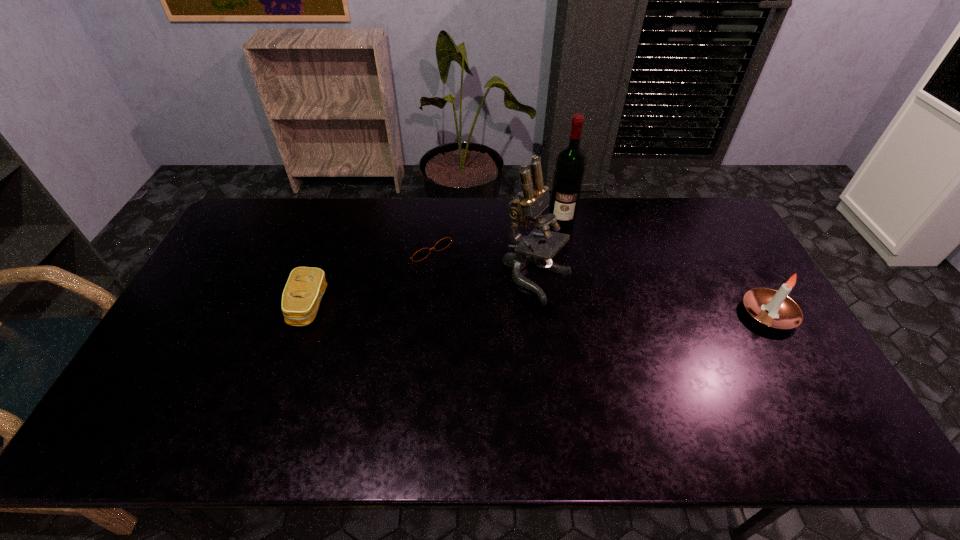
Locate an element on the screen. The height and width of the screenshot is (540, 960). free spot between the rightmost object and the microscope is located at coordinates (653, 296).

Identify the location of vacant region between the rightmost object and the farthest object. The height and width of the screenshot is (540, 960). (665, 267).

Image resolution: width=960 pixels, height=540 pixels. Find the location of `vacant area that lies between the clutch bag and the third tallest object`. vacant area that lies between the clutch bag and the third tallest object is located at coordinates 539,310.

At what (x,y) coordinates should I click in order to perform the action: click on vacant region between the alcohol and the shortest object. Please return your answer as a coordinate pair (x, y). This screenshot has width=960, height=540. Looking at the image, I should click on (492, 232).

The image size is (960, 540). Identify the location of free spot between the farthest object and the candle. (665, 267).

The height and width of the screenshot is (540, 960). In order to click on free space between the third tallest object and the farthest object in this screenshot , I will do `click(665, 267)`.

Locate an element on the screen. This screenshot has width=960, height=540. vacant point located between the clutch bag and the shortest object is located at coordinates (366, 276).

In order to click on vacant space that is in between the microscope and the sunglasses in this screenshot , I will do `click(481, 262)`.

This screenshot has width=960, height=540. What are the coordinates of `free space between the fourth tallest object and the microscope` in the screenshot? It's located at (423, 292).

I want to click on object that can be found as the second closest to the sunglasses, so click(305, 287).